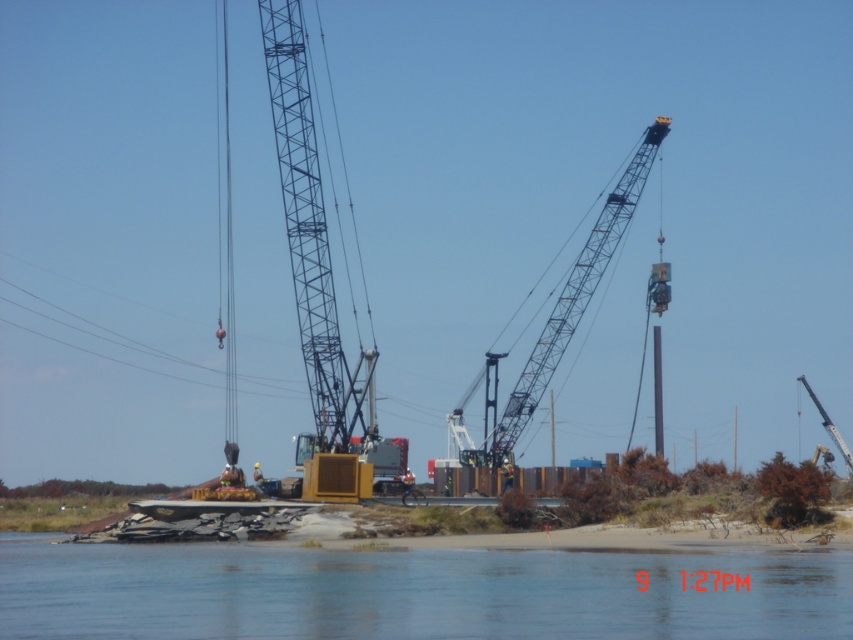
You are a construction worker on the site and need to move a heavy equipment from the shore to the crane. Which object, the clear water at lower center or the metallic blue crane at center, is closer to your current position on the shore?

The clear water at lower center is closer to your current position on the shore because it is in front of the metallic blue crane at center.

You are a construction worker standing on the sandy shoreline. You need to move a heavy equipment from the metallic gray crane at right to the clear water at lower center. Which direction should you move the equipment to reach the water?

The clear water at lower center is to the left of the metallic gray crane at right, so you should move the equipment to the left to reach the water.

You are an engineer inspecting the construction site. You need to access the metallic gray crane at upper right. From your current position near the clear water at lower center, which direction should you move to reach it?

You should move towards the upper right direction from the clear water at lower center to reach the metallic gray crane at upper right since the crane is located above and to the right of the water.